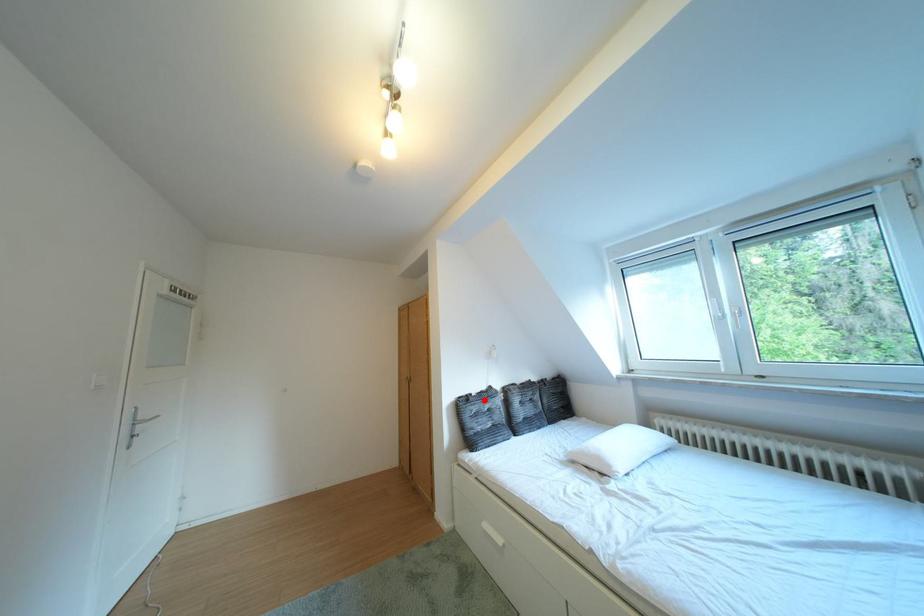
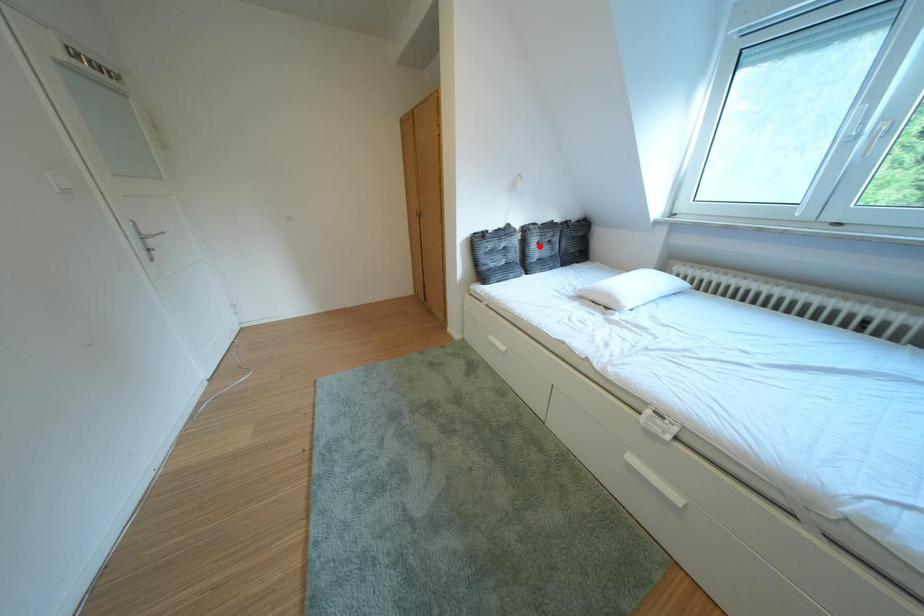
I am providing you with two images of the same scene from different viewpoints. A red point is marked on the first image and another point is marked on the second image. Is the marked point in image1 the same physical position as the marked point in image2?

No